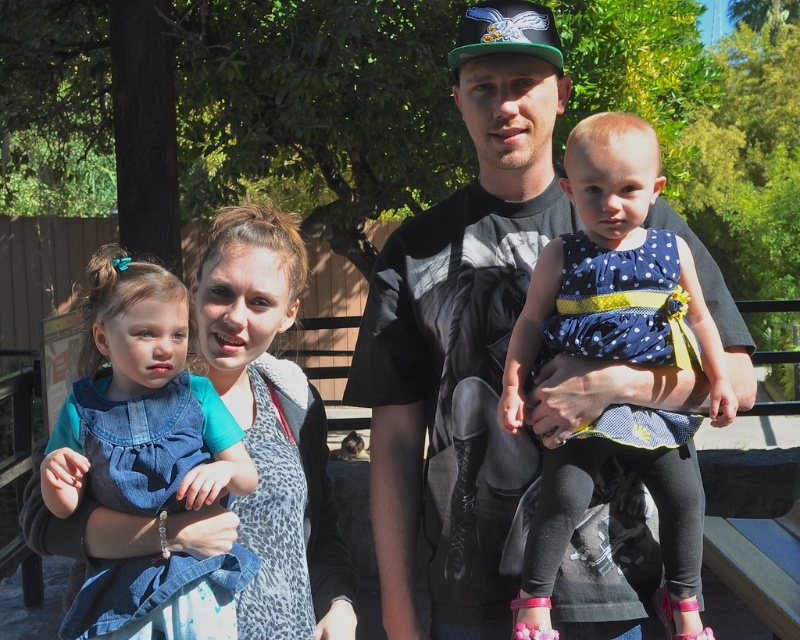
Between black t-shirt at center and leopard print scarf at center, which one is positioned lower?

leopard print scarf at center

Does black t-shirt at center appear on the right side of leopard print scarf at center?

Correct, you'll find black t-shirt at center to the right of leopard print scarf at center.

Is point (434, 493) positioned after point (266, 433)?

Yes, it is.

You are a GUI agent. You are given a task and a screenshot of the screen. Output one action in this format:
    pyautogui.click(x=<x>, y=<y>)
    Task: Click on the black t-shirt at center
    
    Given the screenshot: What is the action you would take?
    [x=476, y=340]

Can you confirm if denim dress at left is thinner than leopard print scarf at center?

Incorrect, denim dress at left's width is not less than leopard print scarf at center's.

Is point (214, 636) farther from camera compared to point (266, 390)?

No, it is in front of (266, 390).

Between point (113, 474) and point (281, 636), which one is positioned in front?

Point (113, 474) is more forward.

This screenshot has height=640, width=800. What are the coordinates of `denim dress at left` in the screenshot? It's located at (140, 403).

Describe the element at coordinates (612, 272) in the screenshot. I see `polka dot fabric dress at center` at that location.

You are a GUI agent. You are given a task and a screenshot of the screen. Output one action in this format:
    pyautogui.click(x=<x>, y=<y>)
    Task: Click on the polka dot fabric dress at center
    
    Given the screenshot: What is the action you would take?
    pyautogui.click(x=612, y=272)